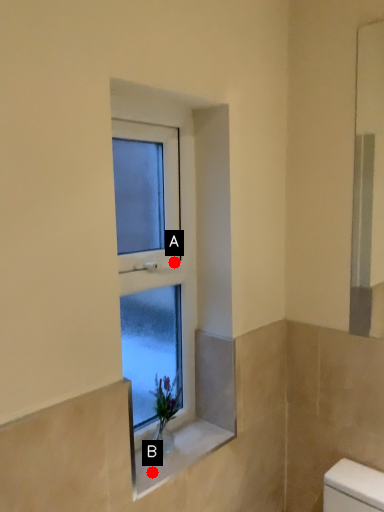
Question: Two points are circled on the image, labeled by A and B beside each circle. Which point is further to the camera?

Choices:
 (A) A is further
 (B) B is further

Answer: (A)